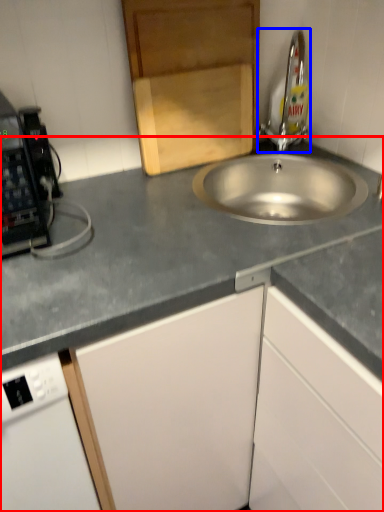
Question: Among these objects, which one is farthest to the camera, countertop (highlighted by a red box) or tap (highlighted by a blue box)?

Choices:
 (A) countertop
 (B) tap

Answer: (B)